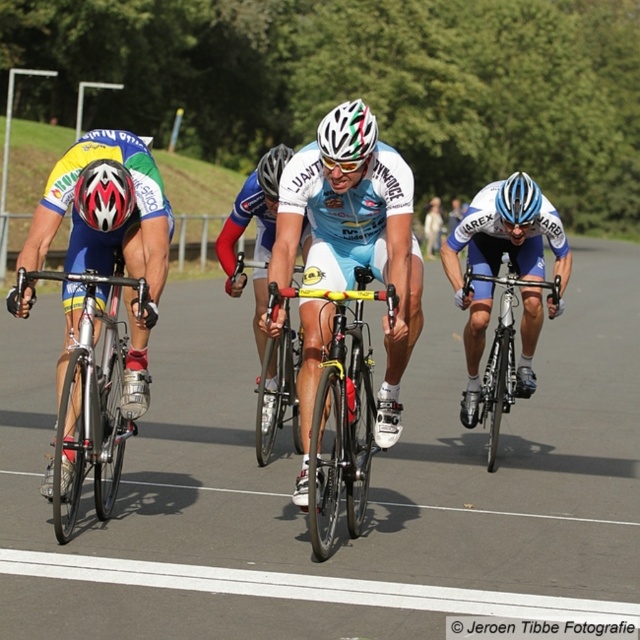
Who is shorter, matte black helmet at left or white matte bicycle helmet at center?

Standing shorter between the two is matte black helmet at left.

Is matte black helmet at left further to camera compared to white matte bicycle helmet at center?

That is False.

Based on the photo, who is more forward, (74, 196) or (289, 160)?

Point (74, 196) is in front.

Identify the location of matte black helmet at left. This screenshot has width=640, height=640. (104, 195).

Between shiny silver bicycle at left and blue matte bicycle helmet at center, which one has less height?

blue matte bicycle helmet at center

Is shiny silver bicycle at left to the left of blue matte bicycle helmet at center from the viewer's perspective?

Correct, you'll find shiny silver bicycle at left to the left of blue matte bicycle helmet at center.

Where is `shiny silver bicycle at left`? This screenshot has width=640, height=640. shiny silver bicycle at left is located at coordinates (90, 400).

Which is more to the right, light blue fabric jersey at center or white matte bicycle helmet at center?

light blue fabric jersey at center is more to the right.

Is point (291, 220) positioned after point (273, 157)?

That is False.

Locate an element on the screen. The image size is (640, 640). light blue fabric jersey at center is located at coordinates (355, 232).